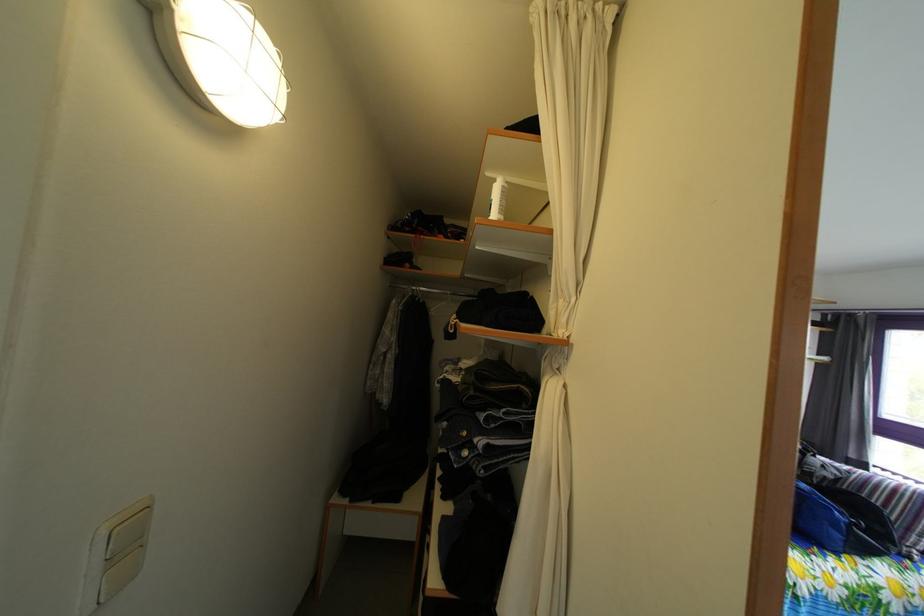
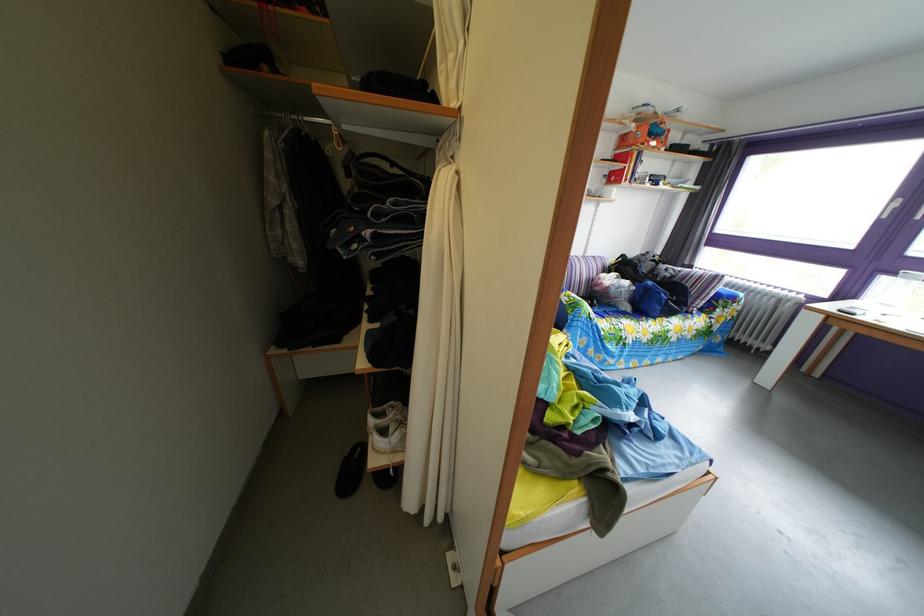
The point at (424,296) is marked in the first image. Where is the corresponding point in the second image?

(306, 126)